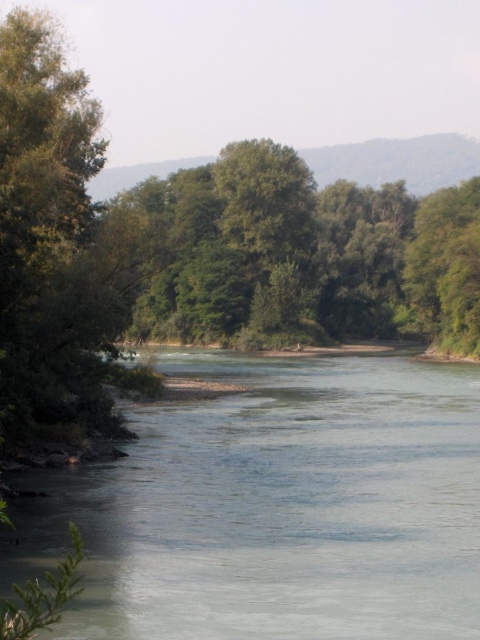
Question: Which object is farther from the camera taking this photo?

Choices:
 (A) green leafy tree at left
 (B) green leafy tree at center
 (C) clear water at center

Answer: (B)

Question: Is clear water at center below green leafy tree at center?

Choices:
 (A) no
 (B) yes

Answer: (B)

Question: Among these points, which one is nearest to the camera?

Choices:
 (A) (392, 156)
 (B) (116, 300)

Answer: (B)

Question: Is the position of green leafy tree at left more distant than that of green leafy tree at center?

Choices:
 (A) yes
 (B) no

Answer: (B)

Question: Is clear water at center wider than green leafy tree at center?

Choices:
 (A) yes
 (B) no

Answer: (B)

Question: Which point is farther to the camera?

Choices:
 (A) clear water at center
 (B) green leafy tree at center
 (C) green leafy tree at left

Answer: (B)